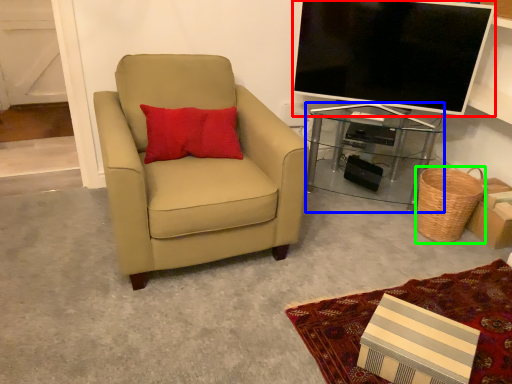
Question: Which object is the closest to the television (highlighted by a red box)? Choose among these: desk (highlighted by a blue box) or basket (highlighted by a green box).

Choices:
 (A) desk
 (B) basket

Answer: (A)